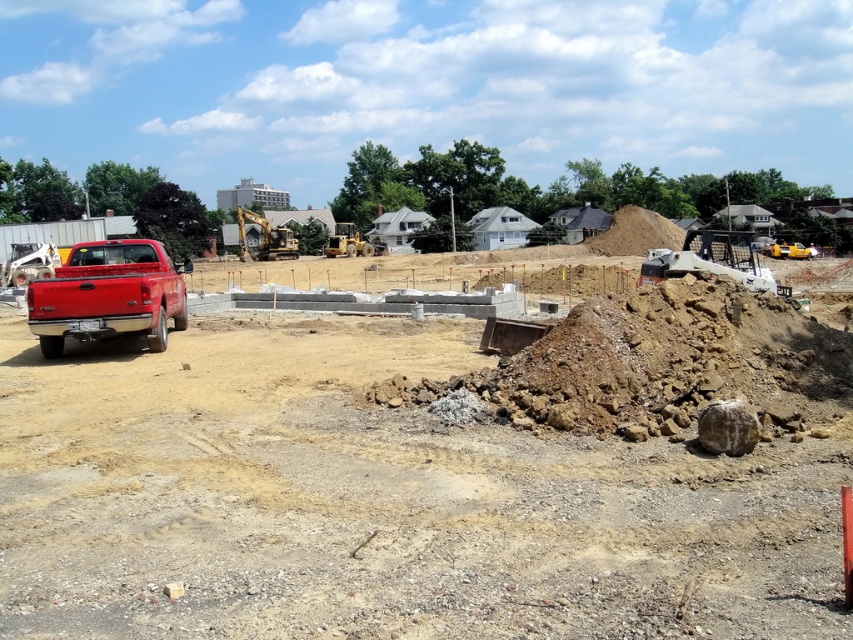
You are a construction worker planning to load materials onto the matte red truck at left using the yellow metallic excavator at center. Considering their heights, which vehicle should you position lower to ensure the materials can be transferred smoothly?

The matte red truck at left has a lesser height compared to the yellow metallic excavator at center. Therefore, you should position the yellow metallic excavator at center lower so that materials can be transferred onto the matte red truck at left without difficulty.

You are a construction worker standing at the center of the construction site. You need to move a heavy load from the matte red truck at left to the metallic silver excavator at right. Which direction should you move the load to ensure it reaches the excavator without obstruction?

The matte red truck at left is positioned under the metallic silver excavator at right, so you should move the load upward to reach the excavator without obstruction.

You are a construction worker standing at the center of the construction site. You notice two points marked on the ground at coordinates point (96, 243) and point (737, 234). Which point is closer to you?

Point (96, 243) is in front of point (737, 234), so it is closer to you.